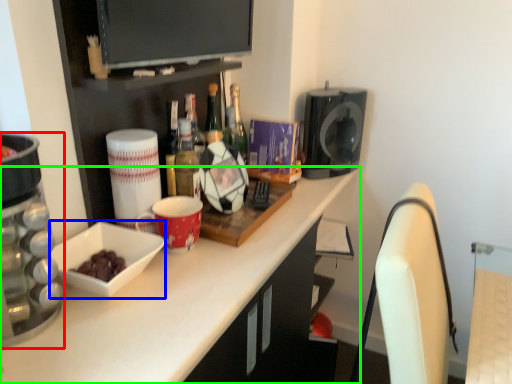
Question: Which object is positioned farthest from home appliance (highlighted by a red box)? Select from bowl (highlighted by a blue box) and countertop (highlighted by a green box).

Choices:
 (A) bowl
 (B) countertop

Answer: (B)